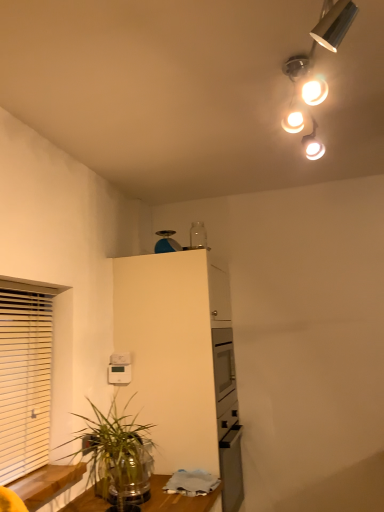
Find the location of a particular element. The width and height of the screenshot is (384, 512). white wooden blinds at left is located at coordinates (25, 376).

What do you see at coordinates (166, 242) in the screenshot?
I see `blue plastic scale at upper center` at bounding box center [166, 242].

The height and width of the screenshot is (512, 384). Find the location of `green leafy plant at lower left`. green leafy plant at lower left is located at coordinates (118, 455).

From the picture: Which object is thinner, white wooden blinds at left or blue plastic scale at upper center?

Thinner between the two is white wooden blinds at left.

Is blue plastic scale at upper center at the back of white wooden blinds at left?

No, white wooden blinds at left's orientation is not away from blue plastic scale at upper center.

Is white wooden blinds at left not inside blue plastic scale at upper center?

Yes.

Does green leafy plant at lower left touch matte silver lamp at upper right?

No, green leafy plant at lower left is not making contact with matte silver lamp at upper right.

The width and height of the screenshot is (384, 512). In order to click on lamp lying in front of the green leafy plant at lower left in this screenshot , I will do `click(323, 36)`.

Considering the relative sizes of green leafy plant at lower left and matte silver lamp at upper right in the image provided, is green leafy plant at lower left taller than matte silver lamp at upper right?

Correct, green leafy plant at lower left is much taller as matte silver lamp at upper right.

Considering the sizes of objects green leafy plant at lower left and matte silver lamp at upper right in the image provided, who is thinner, green leafy plant at lower left or matte silver lamp at upper right?

matte silver lamp at upper right.

In the scene shown: Is matte silver lamp at upper right oriented away from blue plastic scale at upper center?

No, matte silver lamp at upper right's orientation is not away from blue plastic scale at upper center.

Which is in front, point (282, 127) or point (174, 247)?

The point (282, 127) is closer to the camera.

Is matte silver lamp at upper right far away from blue plastic scale at upper center?

matte silver lamp at upper right is positioned a significant distance from blue plastic scale at upper center.

Can you confirm if matte silver lamp at upper right is bigger than blue plastic scale at upper center?

Yes, matte silver lamp at upper right is bigger than blue plastic scale at upper center.

Considering the relative sizes of white matte cabinet at upper center and matte silver lamp at upper right in the image provided, is white matte cabinet at upper center smaller than matte silver lamp at upper right?

No, white matte cabinet at upper center is not smaller than matte silver lamp at upper right.

The width and height of the screenshot is (384, 512). Find the location of `cabinetry on the left side of matte silver lamp at upper right`. cabinetry on the left side of matte silver lamp at upper right is located at coordinates (182, 361).

Is white matte cabinet at upper center not close to matte silver lamp at upper right?

Yes, white matte cabinet at upper center and matte silver lamp at upper right are quite far apart.

How different are the orientations of matte silver lamp at upper right and white matte cabinet at upper center in degrees?

matte silver lamp at upper right and white matte cabinet at upper center are facing 3.42 degrees away from each other.

At what (x,y) coordinates should I click in order to perform the action: click on lamp lying on the right of white matte cabinet at upper center. Please return your answer as a coordinate pair (x, y). Image resolution: width=384 pixels, height=512 pixels. Looking at the image, I should click on (323, 36).

Is matte silver lamp at upper right far away from white matte cabinet at upper center?

Yes.

Does matte silver lamp at upper right have a greater height compared to white matte cabinet at upper center?

No.

Is blue plastic scale at upper center in front of or behind matte silver lamp at upper right in the image?

Clearly, blue plastic scale at upper center is behind matte silver lamp at upper right.

Is blue plastic scale at upper center not inside matte silver lamp at upper right?

blue plastic scale at upper center is positioned outside matte silver lamp at upper right.

Identify the location of lamp that is above the blue plastic scale at upper center (from a real-world perspective). The height and width of the screenshot is (512, 384). (323, 36).

Is blue plastic scale at upper center taller or shorter than matte silver lamp at upper right?

→ blue plastic scale at upper center is shorter than matte silver lamp at upper right.

What's the angular difference between white matte cabinet at upper center and blue plastic scale at upper center's facing directions?

white matte cabinet at upper center and blue plastic scale at upper center are facing 0.00189 degrees away from each other.

Which of these two, white matte cabinet at upper center or blue plastic scale at upper center, stands taller?

Standing taller between the two is white matte cabinet at upper center.

Is blue plastic scale at upper center inside white matte cabinet at upper center?

Definitely not — blue plastic scale at upper center is not inside white matte cabinet at upper center.

From a real-world perspective, who is located lower, white matte cabinet at upper center or blue plastic scale at upper center?

white matte cabinet at upper center.

Identify the location of appliance above the white wooden blinds at left (from a real-world perspective). (166, 242).

Locate an element on the screen. houseplant lying below the matte silver lamp at upper right (from the image's perspective) is located at coordinates (118, 455).

Estimate the real-world distances between objects in this image. Which object is closer to white wooden blinds at left, white matte cabinet at upper center or green leafy plant at lower left?

The object closer to white wooden blinds at left is green leafy plant at lower left.

Considering their positions, is white wooden blinds at left positioned closer to green leafy plant at lower left than blue plastic scale at upper center?

white wooden blinds at left lies closer to green leafy plant at lower left than the other object.

Considering their positions, is blue plastic scale at upper center positioned closer to white wooden blinds at left than white matte cabinet at upper center?

Based on the image, white matte cabinet at upper center appears to be nearer to white wooden blinds at left.

Considering their positions, is matte silver lamp at upper right positioned further to blue plastic scale at upper center than white matte cabinet at upper center?

Among the two, matte silver lamp at upper right is located further to blue plastic scale at upper center.

Estimate the real-world distances between objects in this image. Which object is further from blue plastic scale at upper center, white matte cabinet at upper center or white wooden blinds at left?

white wooden blinds at left.

From the image, which object appears to be farther from green leafy plant at lower left, white wooden blinds at left or white matte cabinet at upper center?

Based on the image, white matte cabinet at upper center appears to be further to green leafy plant at lower left.

Based on their spatial positions, is blue plastic scale at upper center or matte silver lamp at upper right further from white wooden blinds at left?

matte silver lamp at upper right is further to white wooden blinds at left.

Estimate the real-world distances between objects in this image. Which object is further from white wooden blinds at left, green leafy plant at lower left or blue plastic scale at upper center?

blue plastic scale at upper center.

At what (x,y) coordinates should I click in order to perform the action: click on window located between green leafy plant at lower left and blue plastic scale at upper center in the depth direction. Please return your answer as a coordinate pair (x, y). The image size is (384, 512). Looking at the image, I should click on (25, 376).

In order to click on houseplant between matte silver lamp at upper right and white matte cabinet at upper center from top to bottom in this screenshot , I will do `click(118, 455)`.

At what (x,y) coordinates should I click in order to perform the action: click on cabinetry between matte silver lamp at upper right and blue plastic scale at upper center along the z-axis. Please return your answer as a coordinate pair (x, y). The width and height of the screenshot is (384, 512). Looking at the image, I should click on (182, 361).

Where is `window that lies between matte silver lamp at upper right and white matte cabinet at upper center from top to bottom`? Image resolution: width=384 pixels, height=512 pixels. window that lies between matte silver lamp at upper right and white matte cabinet at upper center from top to bottom is located at coordinates point(25,376).